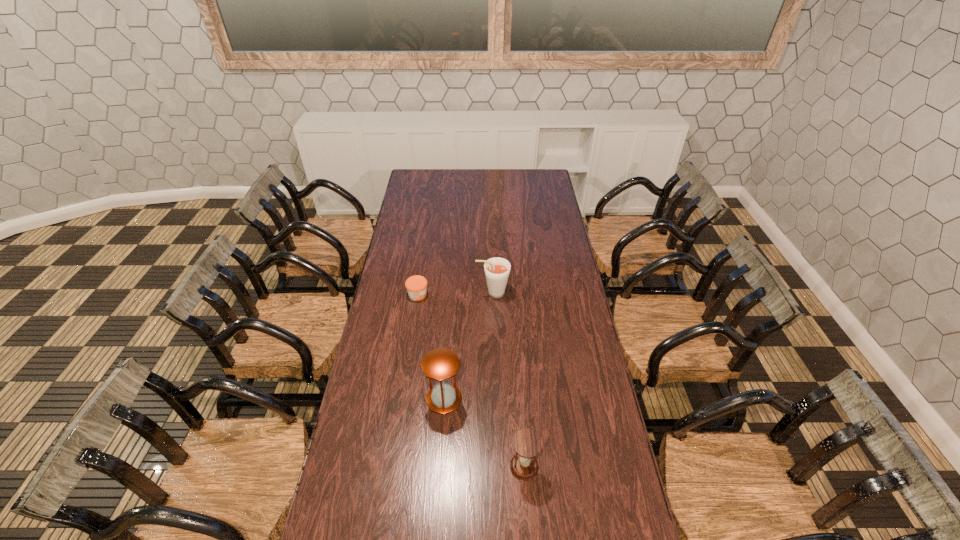
I want to click on root beer, so click(497, 269).

Locate an element on the screen. the left hourglass is located at coordinates (440, 364).

I want to click on the farther hourglass, so click(x=440, y=364).

Find the location of a particular element. The width and height of the screenshot is (960, 540). the second shortest object is located at coordinates (527, 443).

The height and width of the screenshot is (540, 960). I want to click on the shorter hourglass, so click(527, 443).

Find the location of a particular element. The height and width of the screenshot is (540, 960). the shortest object is located at coordinates (416, 285).

Where is `jam`? The width and height of the screenshot is (960, 540). jam is located at coordinates (416, 285).

The height and width of the screenshot is (540, 960). In order to click on vacant space located 0.150m on the drink side of the root beer in this screenshot , I will do `click(443, 293)`.

The image size is (960, 540). In order to click on free space located on the drink side of the root beer in this screenshot , I will do `click(418, 293)`.

In order to click on vacant region located 0.280m on the drink side of the root beer in this screenshot , I will do `click(414, 293)`.